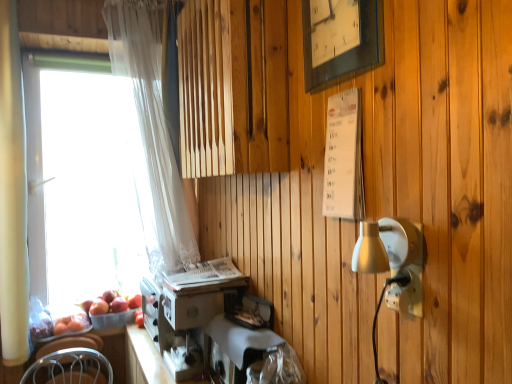
Question: From the image's perspective, is red matte apple at lower left, the 1th apple positioned from the right, located above or below red matte apple at lower left, the 2th apple positioned from the right?

Choices:
 (A) above
 (B) below

Answer: (A)

Question: From a real-world perspective, is red matte apple at lower left, the 2th apple from the left, physically located above or below red matte apple at lower left, the first apple from the left?

Choices:
 (A) above
 (B) below

Answer: (A)

Question: Based on their relative distances, which object is farther from the red matte apple at lower left, the 2th apple positioned from the right?

Choices:
 (A) transparent glass window at left
 (B) metallic silver coffee machine at lower center
 (C) translucent plastic basket at lower left
 (D) wooden frame clock at upper center
 (E) white fabric-covered sewing machine at lower center

Answer: (D)

Question: Which is farther from the white fabric-covered sewing machine at lower center?

Choices:
 (A) metallic silver coffee machine at lower center
 (B) translucent plastic basket at lower left
 (C) white sheer curtain at left, the first curtain positioned from the right
 (D) red matte apple at lower left, the 2th apple positioned from the right
 (E) transparent glass window at left

Answer: (E)